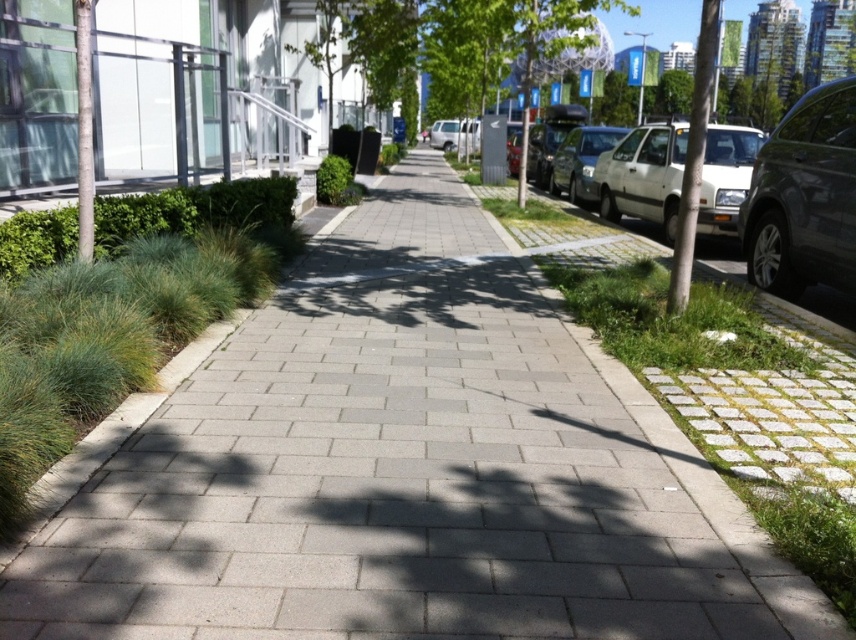
Question: Among these objects, which one is nearest to the camera?

Choices:
 (A) white matte car at right
 (B) white matte van at center

Answer: (A)

Question: Can you confirm if shiny dark gray suv at right is wider than green grass at center?

Choices:
 (A) no
 (B) yes

Answer: (A)

Question: Which point is farther from the camera taking this photo?

Choices:
 (A) (817, 244)
 (B) (655, 364)
 (C) (717, 508)

Answer: (A)

Question: Is green grass at center further to camera compared to white matte van at center?

Choices:
 (A) yes
 (B) no

Answer: (B)

Question: Which point is farther to the camera?

Choices:
 (A) white matte van at center
 (B) shiny dark gray suv at right

Answer: (A)

Question: Does green grass at right have a smaller size compared to silver metallic sedan at right?

Choices:
 (A) yes
 (B) no

Answer: (B)